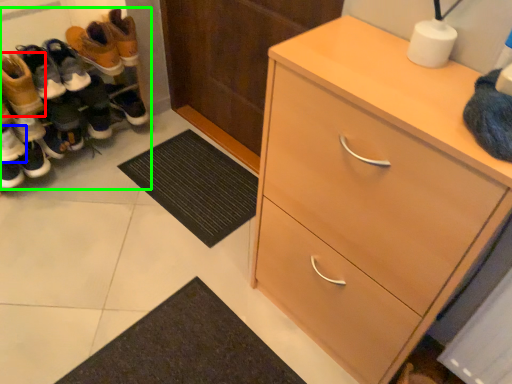
Question: Which object is the farthest from footwear (highlighted by a red box)? Choose among these: footwear (highlighted by a blue box) or footwear (highlighted by a green box).

Choices:
 (A) footwear
 (B) footwear

Answer: (B)